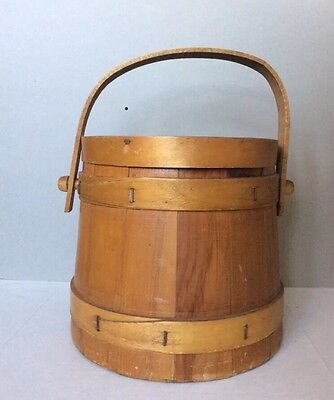
This screenshot has height=400, width=334. I want to click on light brown hardwood surface, so click(x=125, y=258).